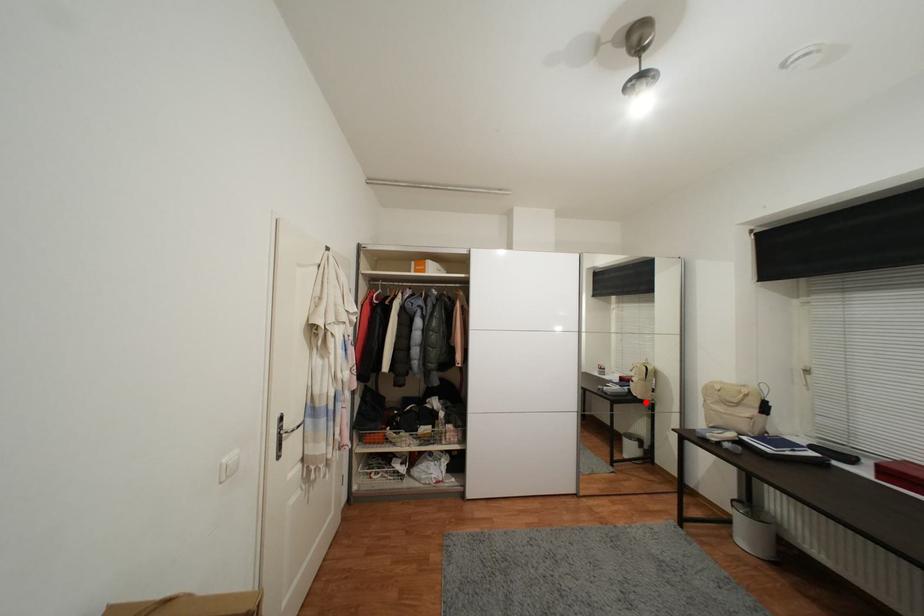
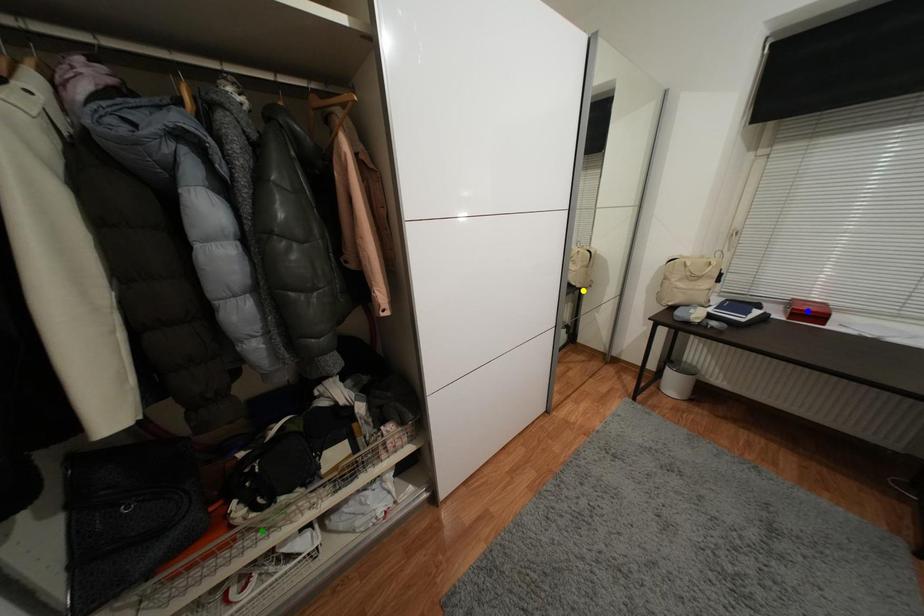
Question: I am providing you with two images of the same scene from different viewpoints. A red point is marked on the first image. You are given multiple points on the second image. Which point in image 2 is actually the same real-world point as the red point in image 1?

Choices:
 (A) blue point
 (B) yellow point
 (C) green point

Answer: (B)